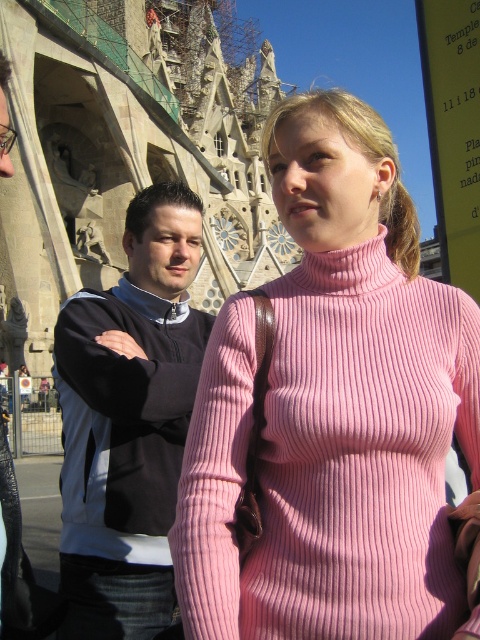
You are standing at a point 110.71 feet away from the camera. You want to take a photo of the Sagrada Familia in Barcelona, Spain. The camera is positioned at point (479, 390). Can you estimate whether you are far enough to capture the entire structure in the photo?

The point (479, 390) is 110.71 feet away from the camera. Since you are standing at that distance, you are far enough to capture the entire Sagrada Familia structure in the photo.

You are a photographer planning to take a portrait of the two people in front of the Sagrada Familia. You notice the pink ribbed sweater at center and the black fabric jacket at left. Which clothing item is shorter in height?

The pink ribbed sweater at center is not as tall as the black fabric jacket at left, so the pink ribbed sweater at center is shorter in height.